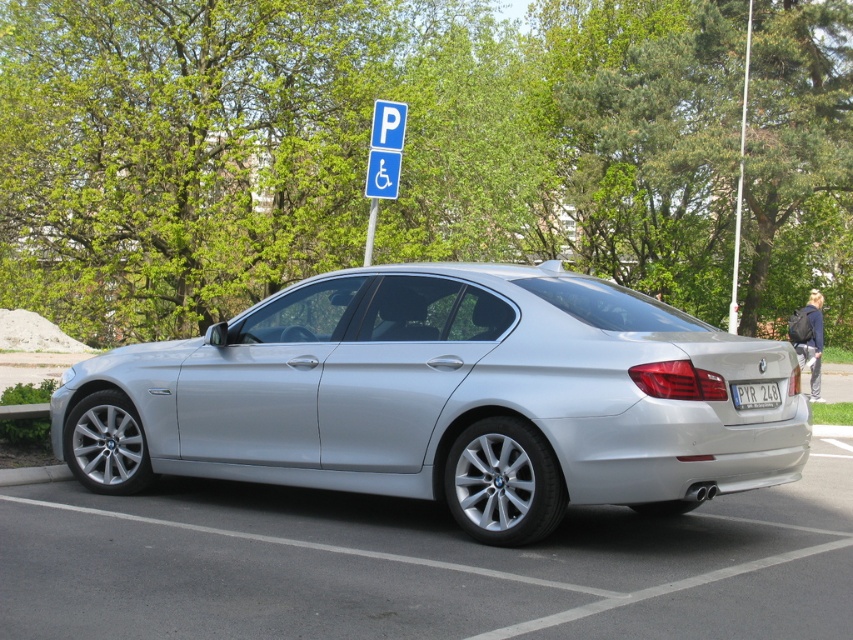
You are a delivery person standing at the camera position. You need to load a package onto the trunk of the satin silver car at center. The package requires 1.5 meters of clearance from the camera to the trunk. Can you reach the trunk without moving the car?

The satin silver car at center is 4.82 meters from camera. Since the required clearance is 1.5 meters, the trunk is within reach without moving the car.